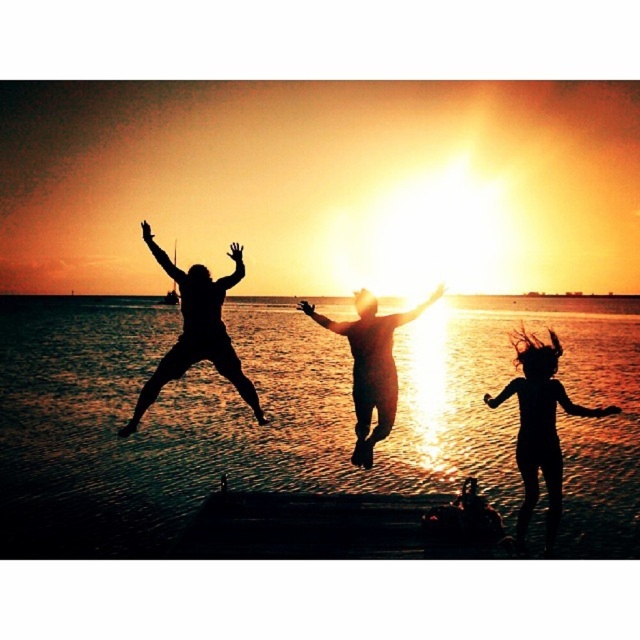
You are a photographer trying to capture the sunset scene at the beach. You want to place a star sticker on the exact location of the silhouette hair at lower right in your photo. According to the coordinates provided, where should you place the sticker on the image grid? Please specify the coordinates as a point in the format like point 0.5,0.5.

The silhouette hair at lower right should be marked at point (540, 428).

You are a photographer trying to capture the sunset scene. You notice the silhouette hair at lower right and the black matte person at center in your frame. Which object in your viewfinder appears shorter?

The silhouette hair at lower right appears shorter than the black matte person at center because it has a lesser height compared to them.

You are standing at the origin point of the coordinate system. You see two points in the scene, point (525,406) and point (369,378). Which point is closer to you?

Point (525,406) is in front of point (369,378), so it is closer to you.